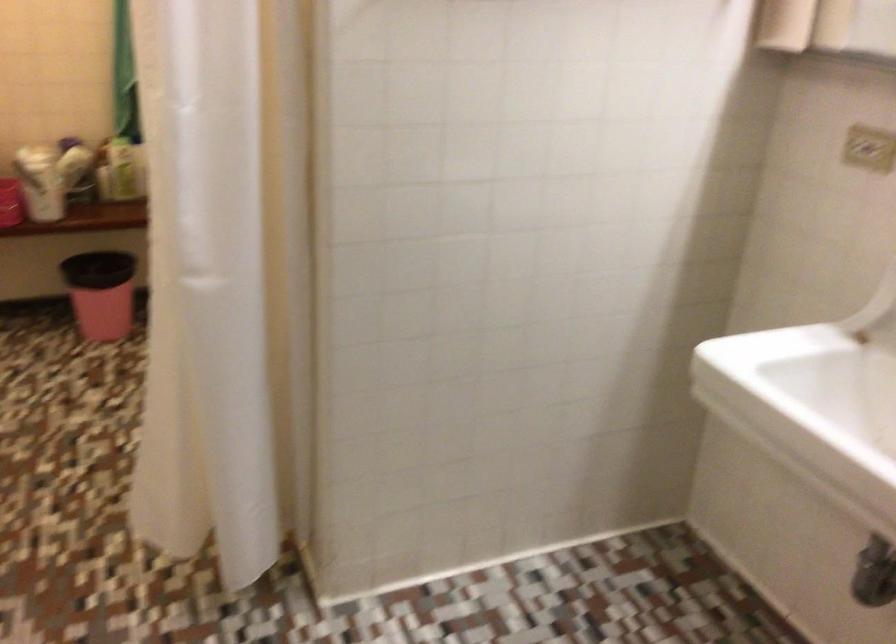
The image size is (896, 644). Identify the location of light switch. (867, 147).